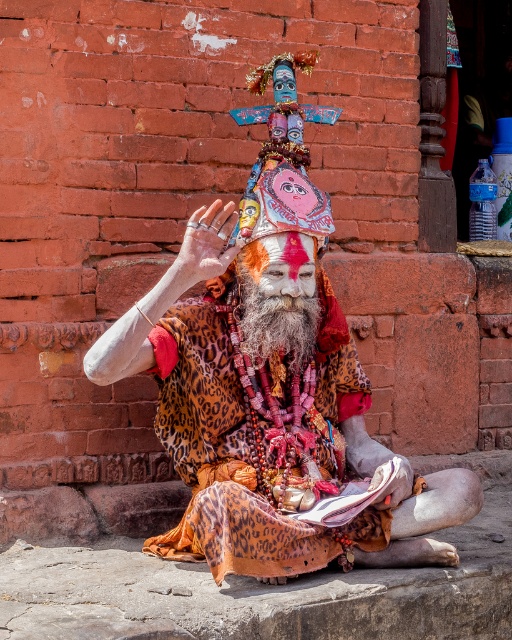
You are a photographer trying to capture the Sadhu in the image. You want to ensure that both the leopard print cloth at center and the grayleopard printbeard at center are clearly visible in your shot. Based on their positions, which one should you focus on first to ensure both are in frame?

The leopard print cloth at center is located below the grayleopard printbeard at center. To ensure both are in frame, focus on the grayleopard printbeard at center first as it is higher up, allowing the cloth to naturally fall into the shot below.

You are a photographer trying to capture the Sadhu in the image. You want to focus on the leopard print cloth at center and the grayleopard printbeard at center. Which object should you adjust your camera focus on first if you want to ensure both are in focus?

The leopard print cloth at center is closer to the viewer than the grayleopard printbeard at center, so you should focus on the leopard print cloth at center first to ensure both are in focus.

You are a photographer trying to capture the Sadhu in the image. You want to ensure both the leopard print cloth at center and the grayleopard printbeard at center are clearly visible in your shot. Given their distance apart, is it possible to frame both in the same photo without moving the camera?

The leopard print cloth at center and grayleopard printbeard at center are 10.23 inches apart. Since both objects are at the center and close to each other, they can be framed together in a single photo without moving the camera.